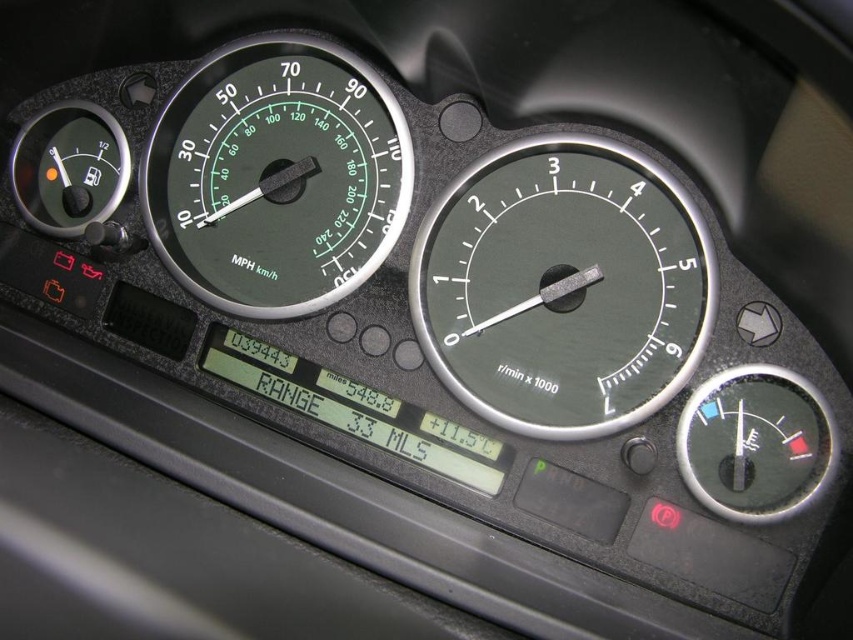
Does matte black tachometer at center have a larger size compared to green matte speedometer at center?

No.

Between point (672, 348) and point (247, 300), which one is positioned behind?

Point (247, 300)

At what (x,y) coordinates should I click in order to perform the action: click on matte black tachometer at center. Please return your answer as a coordinate pair (x, y). Looking at the image, I should click on [573, 268].

In order to click on matte black tachometer at center in this screenshot , I will do `click(573, 268)`.